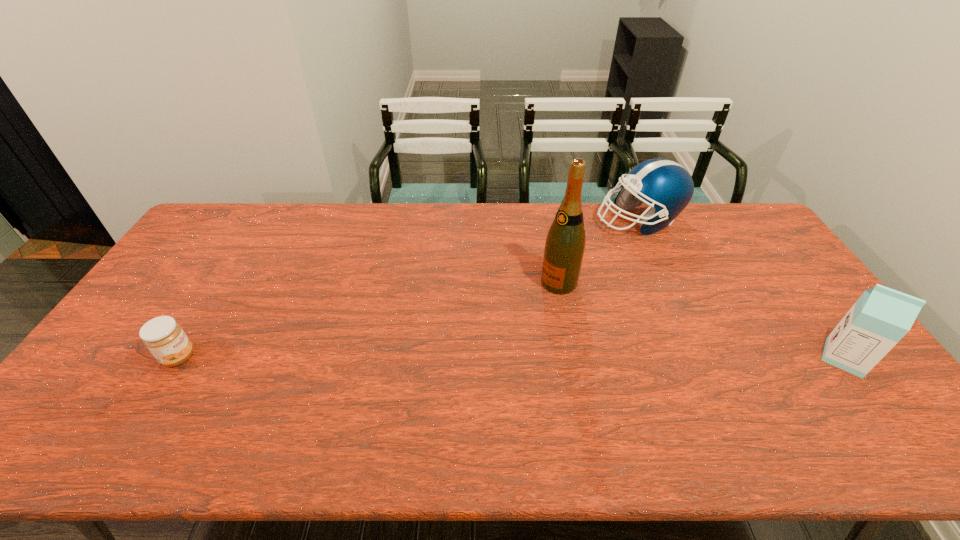
Image resolution: width=960 pixels, height=540 pixels. In order to click on free space that is in between the farthest object and the milk carton in this screenshot , I will do `click(741, 289)`.

I want to click on free spot between the tallest object and the rightmost object, so [x=702, y=320].

The width and height of the screenshot is (960, 540). In order to click on free spot between the third object from right to left and the rightmost object in this screenshot , I will do `click(702, 320)`.

At what (x,y) coordinates should I click in order to perform the action: click on free point between the rightmost object and the wine bottle. Please return your answer as a coordinate pair (x, y). Looking at the image, I should click on (702, 320).

Locate an element on the screen. vacant space in between the milk carton and the leftmost object is located at coordinates pyautogui.click(x=512, y=357).

Select which object is the third closest to the wine bottle. Please provide its 2D coordinates. Your answer should be formatted as a tuple, i.e. [(x, y)], where the tuple contains the x and y coordinates of a point satisfying the conditions above.

[(163, 336)]

Locate an element on the screen. This screenshot has height=540, width=960. the closest object to the football helmet is located at coordinates (565, 243).

At what (x,y) coordinates should I click in order to perform the action: click on vacant region that satisfies the following two spatial constraints: 1. on the back side of the tallest object; 2. on the left side of the football helmet. Please return your answer as a coordinate pair (x, y). The height and width of the screenshot is (540, 960). Looking at the image, I should click on (547, 220).

Locate an element on the screen. vacant space that satisfies the following two spatial constraints: 1. on the front side of the milk carton; 2. on the right side of the tallest object is located at coordinates (573, 357).